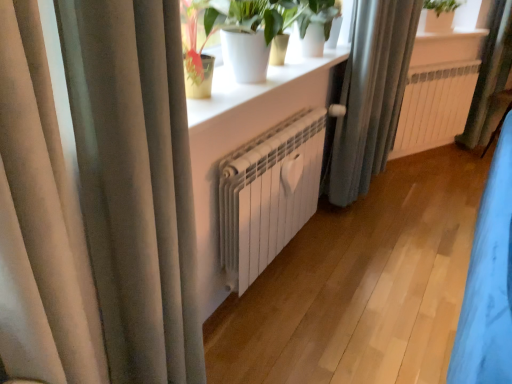
Question: Can you confirm if satin beige curtain at left, the first curtain in the left-to-right sequence, is shorter than white matte pot at upper center?

Choices:
 (A) no
 (B) yes

Answer: (A)

Question: Considering the relative sizes of satin beige curtain at left, the third curtain when ordered from back to front, and white matte pot at upper center in the image provided, is satin beige curtain at left, the third curtain when ordered from back to front, bigger than white matte pot at upper center?

Choices:
 (A) no
 (B) yes

Answer: (B)

Question: Considering the relative positions of satin beige curtain at left, which is the third curtain from right to left, and white matte pot at upper center in the image provided, is satin beige curtain at left, which is the third curtain from right to left, in front of white matte pot at upper center?

Choices:
 (A) yes
 (B) no

Answer: (A)

Question: Does satin beige curtain at left, the first curtain in the left-to-right sequence, contain white matte pot at upper center?

Choices:
 (A) no
 (B) yes

Answer: (A)

Question: From a real-world perspective, is satin beige curtain at left, the first curtain from the front, positioned over white matte pot at upper center based on gravity?

Choices:
 (A) no
 (B) yes

Answer: (A)

Question: From their relative heights in the image, would you say white matte radiator at center, which appears as the first radiator when viewed from the right, is taller or shorter than satin beige curtain at left, the first curtain from the front?

Choices:
 (A) tall
 (B) short

Answer: (B)

Question: From the image's perspective, is white matte radiator at center, which is counted as the 2th radiator, starting from the bottom, located above or below satin beige curtain at left, the first curtain from the front?

Choices:
 (A) below
 (B) above

Answer: (B)

Question: Relative to satin beige curtain at left, the third curtain when ordered from back to front, is white matte radiator at center, which appears as the first radiator when viewed from the right, in front or behind?

Choices:
 (A) front
 (B) behind

Answer: (B)

Question: Based on their positions, is white matte radiator at center, marked as the 2th radiator in a front-to-back arrangement, located to the left or right of satin beige curtain at left, the third curtain when ordered from back to front?

Choices:
 (A) right
 (B) left

Answer: (A)

Question: Is point (354, 162) closer or farther from the camera than point (221, 208)?

Choices:
 (A) farther
 (B) closer

Answer: (A)

Question: From a real-world perspective, is gray fabric curtain at center, which is the second curtain in back-to-front order, positioned above or below white matte radiator at center, the 1th radiator from the front?

Choices:
 (A) above
 (B) below

Answer: (A)

Question: From the image's perspective, is gray fabric curtain at center, the second curtain viewed from the left, located above or below white matte radiator at center, marked as the first radiator in a left-to-right arrangement?

Choices:
 (A) above
 (B) below

Answer: (A)

Question: Considering the positions of gray fabric curtain at center, the second curtain viewed from the left, and white matte radiator at center, marked as the first radiator in a left-to-right arrangement, in the image, is gray fabric curtain at center, the second curtain viewed from the left, wider or thinner than white matte radiator at center, marked as the first radiator in a left-to-right arrangement,?

Choices:
 (A) wide
 (B) thin

Answer: (A)

Question: Is point (397, 49) positioned closer to the camera than point (441, 140)?

Choices:
 (A) closer
 (B) farther

Answer: (A)

Question: Is gray fabric curtain at center, the second curtain viewed from the left, to the left or to the right of white matte radiator at center, the 2th radiator from the left, in the image?

Choices:
 (A) left
 (B) right

Answer: (A)